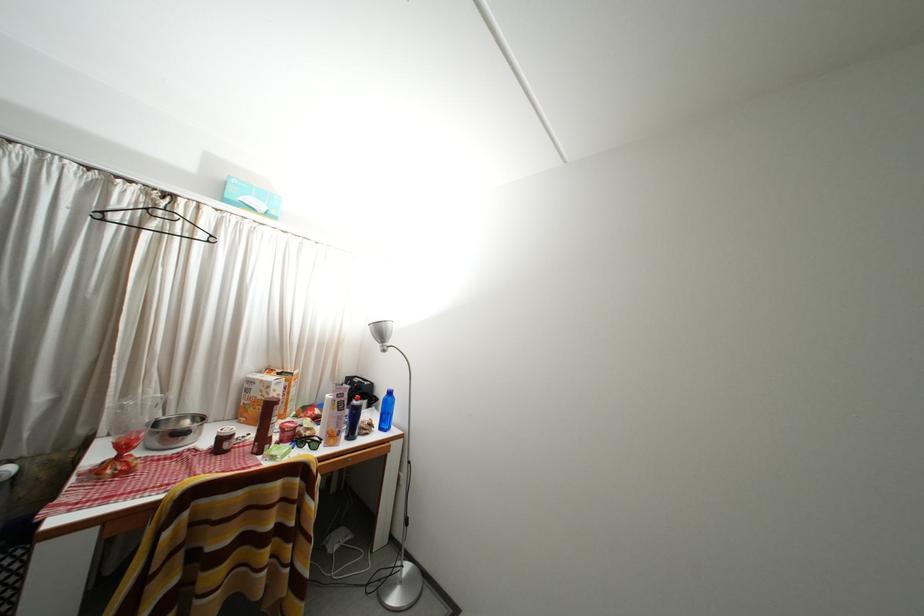
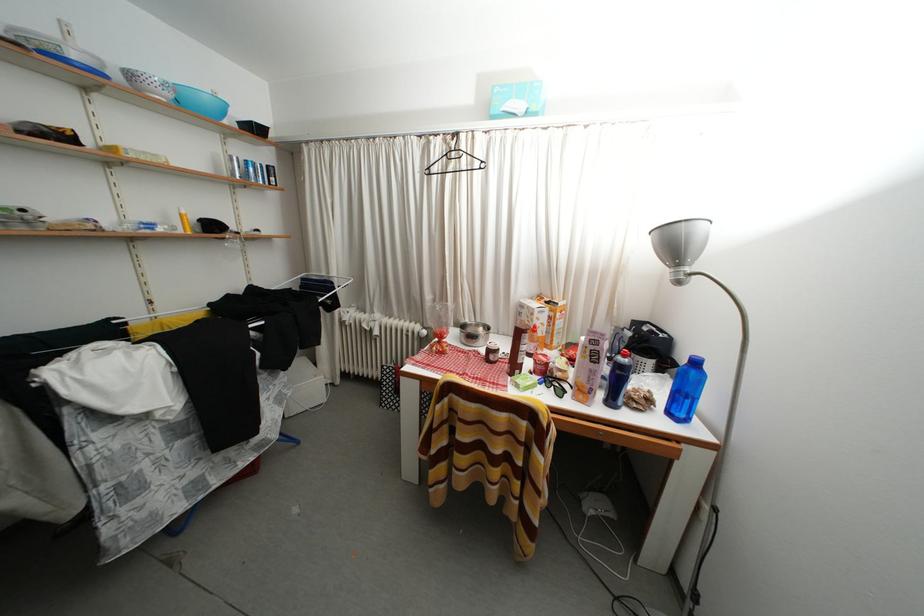
In the second image, find the point that corresponds to point (161, 230) in the first image.

(458, 172)